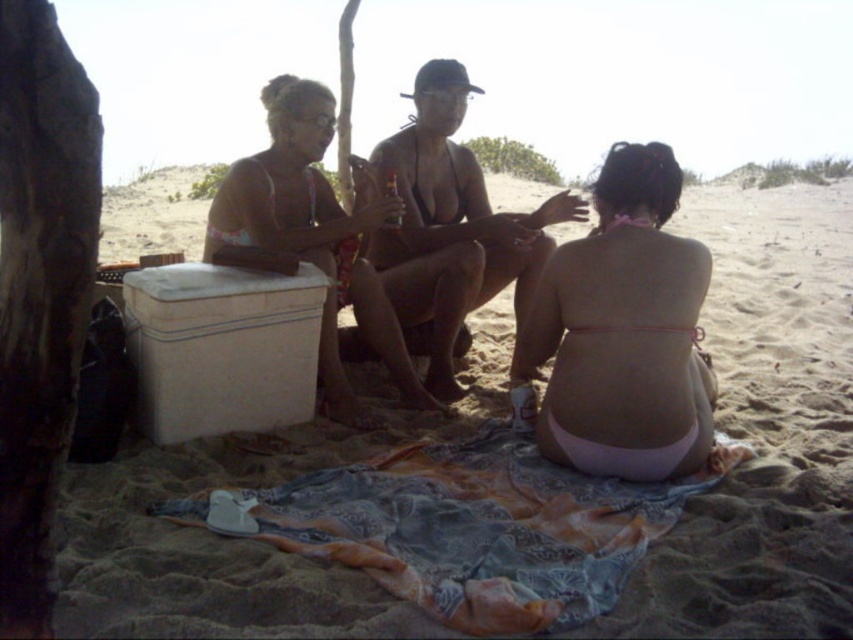
Question: Does printed cotton blanket at lower center have a lesser width compared to white matte cooler at left?

Choices:
 (A) yes
 (B) no

Answer: (B)

Question: Which of these objects is positioned closest to the white matte cooler at left?

Choices:
 (A) printed cotton blanket at lower center
 (B) matte black bikini at center
 (C) pink fabric bikini at lower right
 (D) matte skin man at center

Answer: (B)

Question: Is matte skin man at center further to the viewer compared to matte black bikini at center?

Choices:
 (A) no
 (B) yes

Answer: (B)

Question: From the image, what is the correct spatial relationship of white matte cooler at left in relation to matte skin man at center?

Choices:
 (A) left
 (B) right

Answer: (A)

Question: Which of these objects is positioned farthest from the matte black bikini at center?

Choices:
 (A) pink fabric bikini at lower right
 (B) white matte cooler at left
 (C) matte skin man at center

Answer: (A)

Question: Which point appears farthest from the camera in this image?

Choices:
 (A) pyautogui.click(x=276, y=108)
 (B) pyautogui.click(x=532, y=531)
 (C) pyautogui.click(x=572, y=275)

Answer: (A)